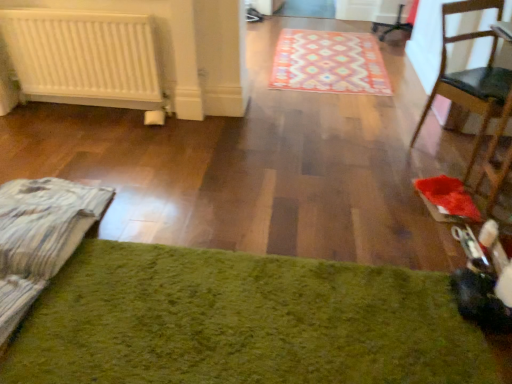
Question: Could you tell me if patterned carpet at center, positioned as the 1th mat in back-to-front order, is facing wooden chair at right?

Choices:
 (A) no
 (B) yes

Answer: (A)

Question: Is wooden chair at right completely or partially inside patterned carpet at center, positioned as the 2th mat in bottom-to-top order?

Choices:
 (A) no
 (B) yes

Answer: (A)

Question: Can you confirm if patterned carpet at center, positioned as the 1th mat in back-to-front order, is thinner than wooden chair at right?

Choices:
 (A) yes
 (B) no

Answer: (B)

Question: Can you confirm if patterned carpet at center, which ranks as the second mat in front-to-back order, is smaller than wooden chair at right?

Choices:
 (A) yes
 (B) no

Answer: (A)

Question: Is patterned carpet at center, the 1th mat from the top, not near wooden chair at right?

Choices:
 (A) yes
 (B) no

Answer: (A)

Question: Would you say white matte radiator at left is to the left or to the right of patterned carpet at center, which ranks as the second mat in front-to-back order, in the picture?

Choices:
 (A) right
 (B) left

Answer: (B)

Question: From the image's perspective, is white matte radiator at left positioned above or below patterned carpet at center, positioned as the 1th mat in back-to-front order?

Choices:
 (A) above
 (B) below

Answer: (B)

Question: Is point pyautogui.click(x=135, y=41) positioned closer to the camera than point pyautogui.click(x=330, y=77)?

Choices:
 (A) closer
 (B) farther

Answer: (A)

Question: Considering the positions of white matte radiator at left and patterned carpet at center, which ranks as the second mat in front-to-back order, in the image, is white matte radiator at left wider or thinner than patterned carpet at center, which ranks as the second mat in front-to-back order,?

Choices:
 (A) wide
 (B) thin

Answer: (B)

Question: Visually, is wooden chair at right positioned to the left or to the right of patterned carpet at center, positioned as the 2th mat in bottom-to-top order?

Choices:
 (A) right
 (B) left

Answer: (A)

Question: From a real-world perspective, is wooden chair at right above or below patterned carpet at center, the 1th mat from the top?

Choices:
 (A) below
 (B) above

Answer: (B)

Question: Is wooden chair at right taller or shorter than patterned carpet at center, positioned as the 1th mat in back-to-front order?

Choices:
 (A) short
 (B) tall

Answer: (B)

Question: Based on their sizes in the image, would you say wooden chair at right is bigger or smaller than patterned carpet at center, positioned as the 1th mat in back-to-front order?

Choices:
 (A) small
 (B) big

Answer: (B)

Question: Is point (390, 365) closer or farther from the camera than point (291, 71)?

Choices:
 (A) closer
 (B) farther

Answer: (A)

Question: In terms of width, does green shaggy rug at lower center, which is the first mat from bottom to top, look wider or thinner when compared to patterned carpet at center, the 1th mat from the top?

Choices:
 (A) wide
 (B) thin

Answer: (B)